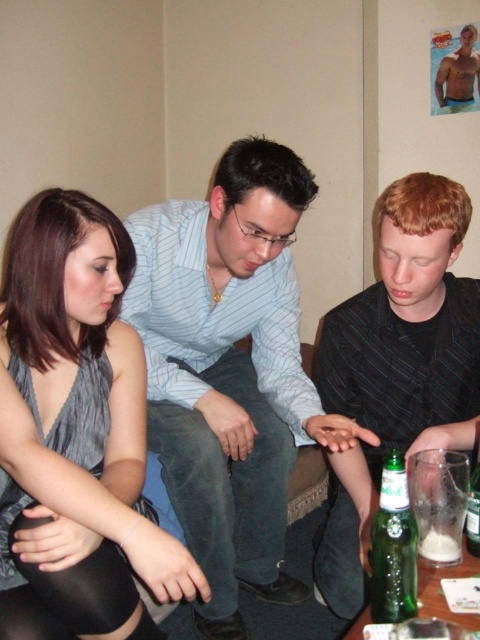
You are trying to place a new object between the muscular tan torso at upper right and the green glass bottle at lower right. Based on their widths, can you determine if there will be enough space for the object?

The muscular tan torso at upper right might be wider than the green glass bottle at lower right, so there may not be enough space between them for the new object.